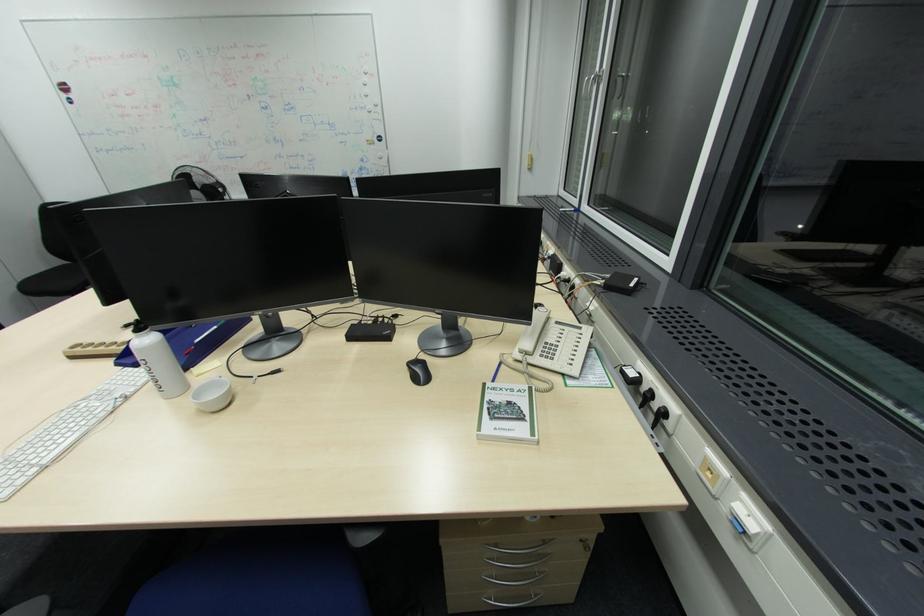
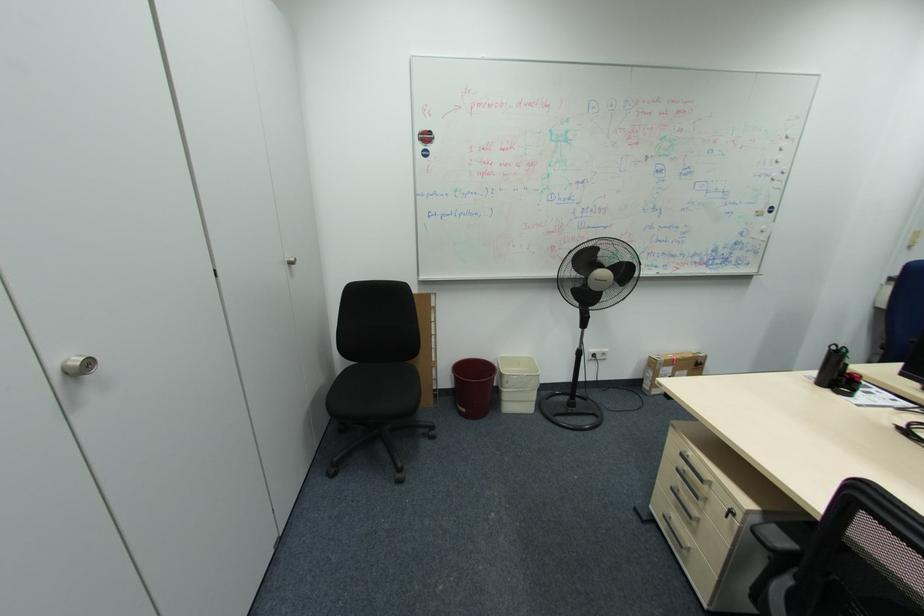
Question: In a continuous first-person perspective shot, in which direction is the camera moving?

Choices:
 (A) Left
 (B) Right
 (C) Forward
 (D) Backward

Answer: (A)